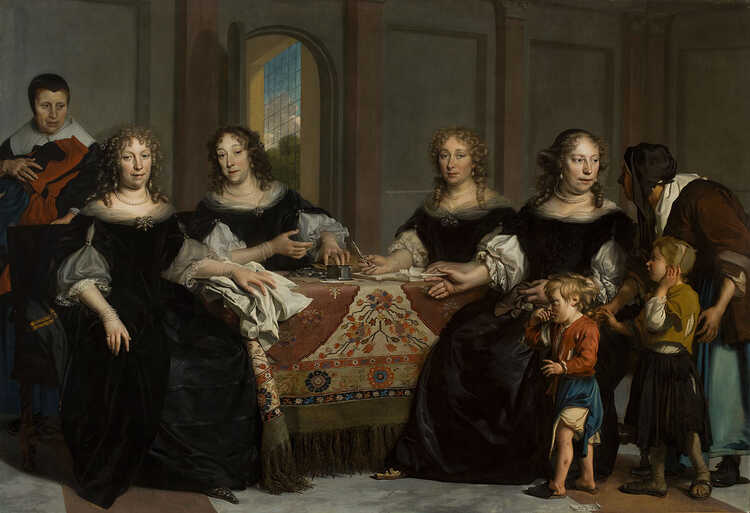
At what (x,y) coordinates should I click in order to perform the action: click on embroidered tablecloth. Please return your answer as a coordinate pair (x, y). Looking at the image, I should click on (358, 315).